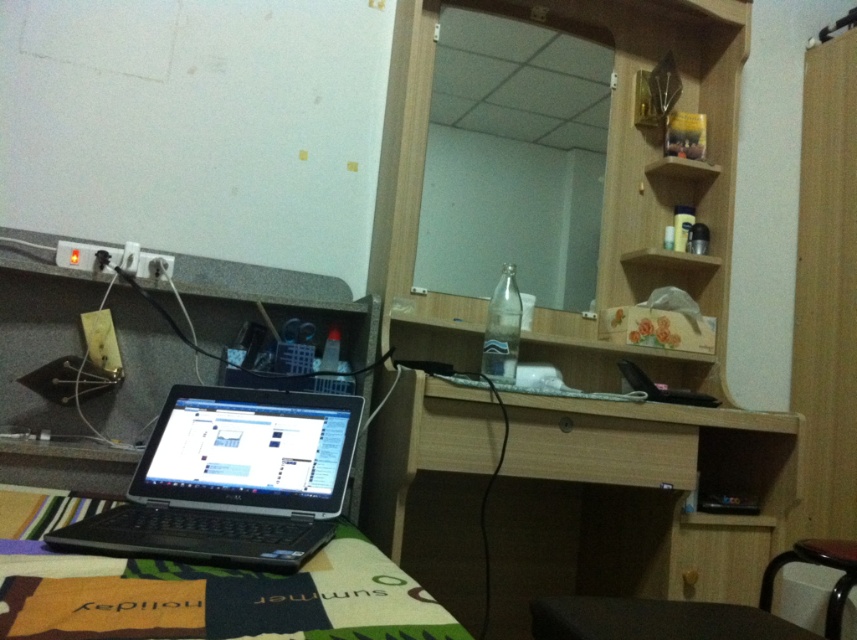
Question: Among these points, which one is farthest from the camera?

Choices:
 (A) (814, 548)
 (B) (660, 557)
 (C) (279, 621)

Answer: (B)

Question: Estimate the real-world distances between objects in this image. Which object is closer to the wooden drawer at center?

Choices:
 (A) light wood/wooden computer desk at center
 (B) black matte laptop at lower left

Answer: (A)

Question: Considering the real-world distances, which object is farthest from the black plastic laptop at lower left?

Choices:
 (A) black matte laptop at lower left
 (B) light wood/wooden computer desk at center
 (C) wooden drawer at center

Answer: (B)

Question: Is the position of light wood/wooden computer desk at center more distant than that of brown wooden stool at lower right?

Choices:
 (A) no
 (B) yes

Answer: (A)

Question: Considering the relative positions of black matte laptop at lower left and wooden drawer at center in the image provided, where is black matte laptop at lower left located with respect to wooden drawer at center?

Choices:
 (A) left
 (B) right

Answer: (A)

Question: From the image, what is the correct spatial relationship of black plastic laptop at lower left in relation to brown wooden stool at lower right?

Choices:
 (A) left
 (B) right

Answer: (A)